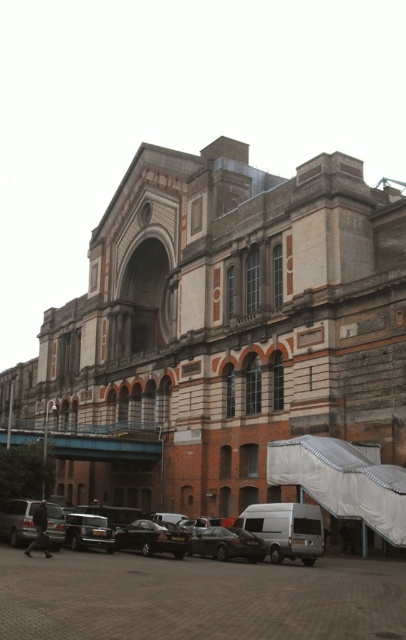
You are standing at the entrance of the historic building and notice a point marked at coordinates (343,481). What object does this point correspond to in the scene?

The point corresponds to the white textured canopy at lower right.

You are a delivery person who needs to park your delivery van, which is 2 meters tall, in the parking lot. Can the shiny black car at center fit under the black asphalt parking lot at lower center without hitting its roof?

The black asphalt parking lot at lower center has a greater height compared to shiny black car at center. Since the parking lot is taller than the car, the car can safely pass under it without hitting the roof.